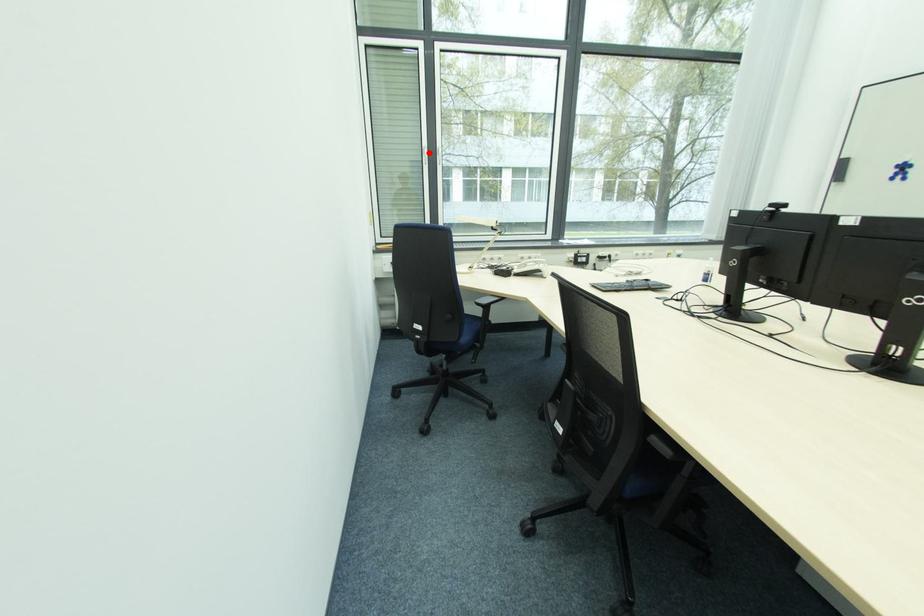
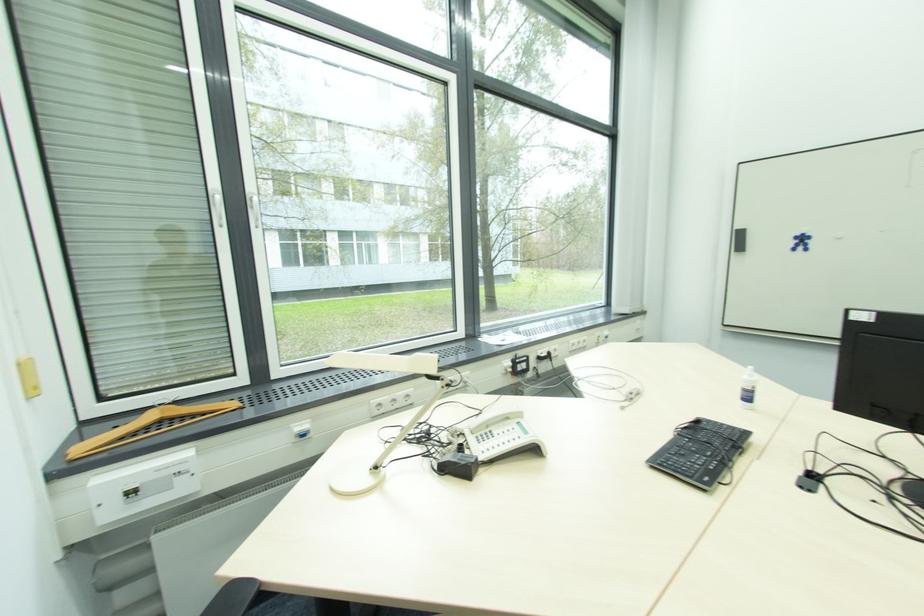
The point at the highlighted location is marked in the first image. Where is the corresponding point in the second image?

(223, 200)